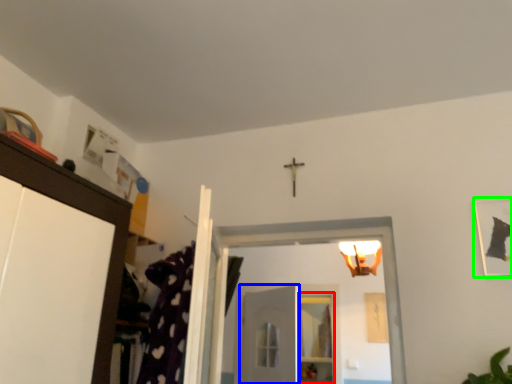
Question: Based on their relative distances, which object is nearer to shelf (highlighted by a red box)? Choose from door (highlighted by a blue box) and picture frame (highlighted by a green box).

Choices:
 (A) door
 (B) picture frame

Answer: (A)